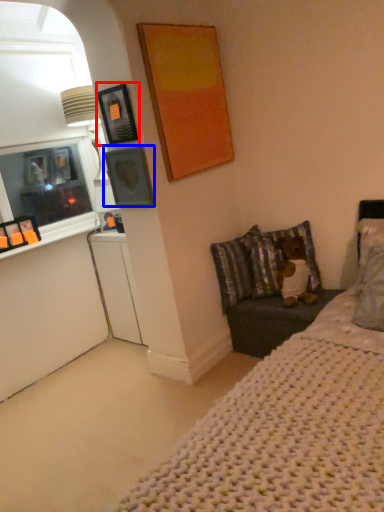
Question: Which object is further to the camera taking this photo, picture frame (highlighted by a red box) or picture frame (highlighted by a blue box)?

Choices:
 (A) picture frame
 (B) picture frame

Answer: (B)